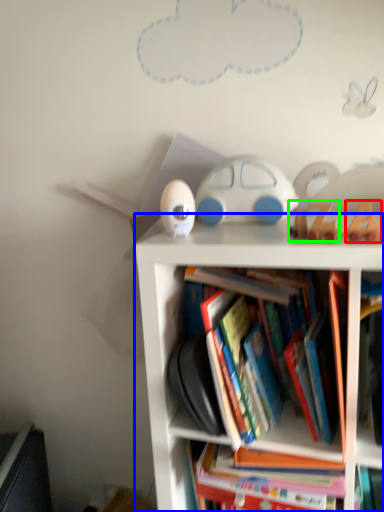
Question: Which object is positioned closest to toy (highlighted by a red box)? Select from bookcase (highlighted by a blue box) and toy (highlighted by a green box).

Choices:
 (A) bookcase
 (B) toy

Answer: (B)